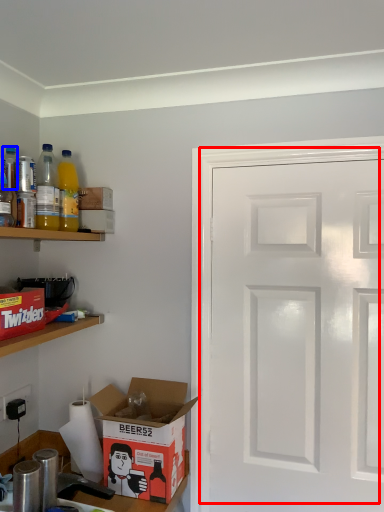
Question: Which object appears farthest to the camera in this image, door (highlighted by a red box) or bottle (highlighted by a blue box)?

Choices:
 (A) door
 (B) bottle

Answer: (A)